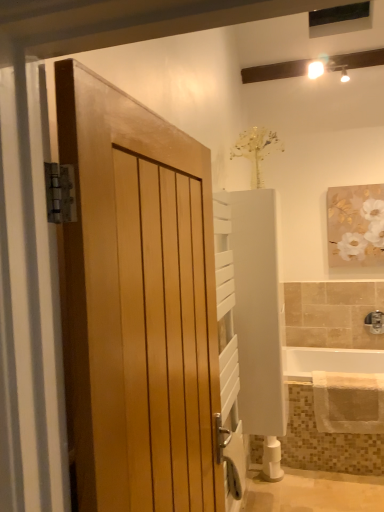
Question: Considering the relative positions of satin nickel faucet at lower right and white matte painting at upper right in the image provided, is satin nickel faucet at lower right behind white matte painting at upper right?

Choices:
 (A) no
 (B) yes

Answer: (B)

Question: Is satin nickel faucet at lower right turned away from white matte painting at upper right?

Choices:
 (A) no
 (B) yes

Answer: (A)

Question: Considering the relative sizes of satin nickel faucet at lower right and white matte painting at upper right in the image provided, is satin nickel faucet at lower right bigger than white matte painting at upper right?

Choices:
 (A) yes
 (B) no

Answer: (B)

Question: Is satin nickel faucet at lower right thinner than white matte painting at upper right?

Choices:
 (A) no
 (B) yes

Answer: (A)

Question: Is satin nickel faucet at lower right shorter than white matte painting at upper right?

Choices:
 (A) yes
 (B) no

Answer: (A)

Question: Looking at their shapes, would you say white matte toilet paper at lower center is wider or thinner than white glossy bathtub at lower right?

Choices:
 (A) thin
 (B) wide

Answer: (A)

Question: Does point (266, 470) appear closer or farther from the camera than point (347, 358)?

Choices:
 (A) farther
 (B) closer

Answer: (B)

Question: Relative to white glossy bathtub at lower right, is white matte toilet paper at lower center in front or behind?

Choices:
 (A) behind
 (B) front

Answer: (A)

Question: From a real-world perspective, is white matte toilet paper at lower center above or below white glossy bathtub at lower right?

Choices:
 (A) above
 (B) below

Answer: (B)

Question: Looking at the image, does white matte painting at upper right seem bigger or smaller compared to white matte toilet paper at lower center?

Choices:
 (A) small
 (B) big

Answer: (B)

Question: From their relative heights in the image, would you say white matte painting at upper right is taller or shorter than white matte toilet paper at lower center?

Choices:
 (A) tall
 (B) short

Answer: (A)

Question: Based on their positions, is white matte painting at upper right located to the left or right of white matte toilet paper at lower center?

Choices:
 (A) right
 (B) left

Answer: (A)

Question: Looking at their shapes, would you say white matte painting at upper right is wider or thinner than white matte toilet paper at lower center?

Choices:
 (A) wide
 (B) thin

Answer: (B)

Question: From the image's perspective, is white glossy bathtub at lower right located above or below beige textured bath towel at lower right?

Choices:
 (A) above
 (B) below

Answer: (A)

Question: Considering the positions of white glossy bathtub at lower right and beige textured bath towel at lower right in the image, is white glossy bathtub at lower right wider or thinner than beige textured bath towel at lower right?

Choices:
 (A) thin
 (B) wide

Answer: (B)